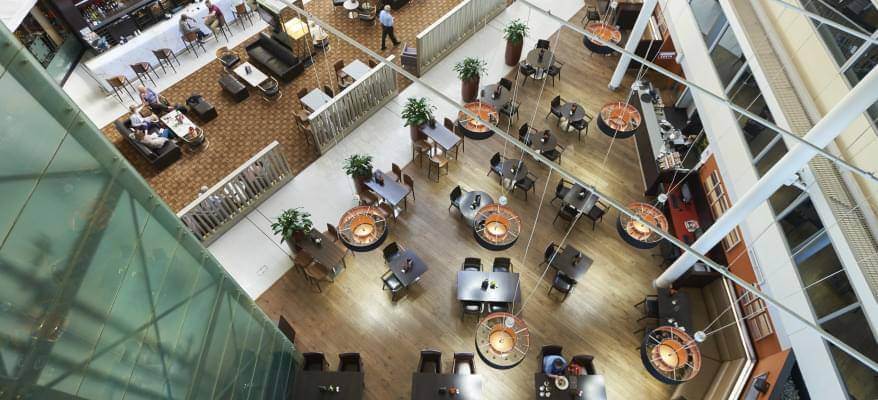
Where is `light fixtures`? Image resolution: width=878 pixels, height=400 pixels. light fixtures is located at coordinates (363, 230), (502, 340), (670, 355), (641, 228), (497, 228), (621, 116), (601, 31), (473, 121), (299, 30).